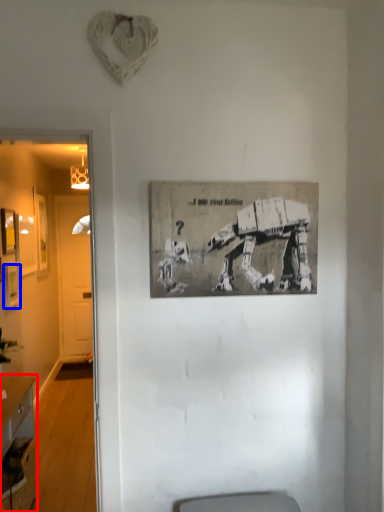
Question: Among these objects, which one is nearest to the camera, desk (highlighted by a red box) or picture frame (highlighted by a blue box)?

Choices:
 (A) desk
 (B) picture frame

Answer: (A)